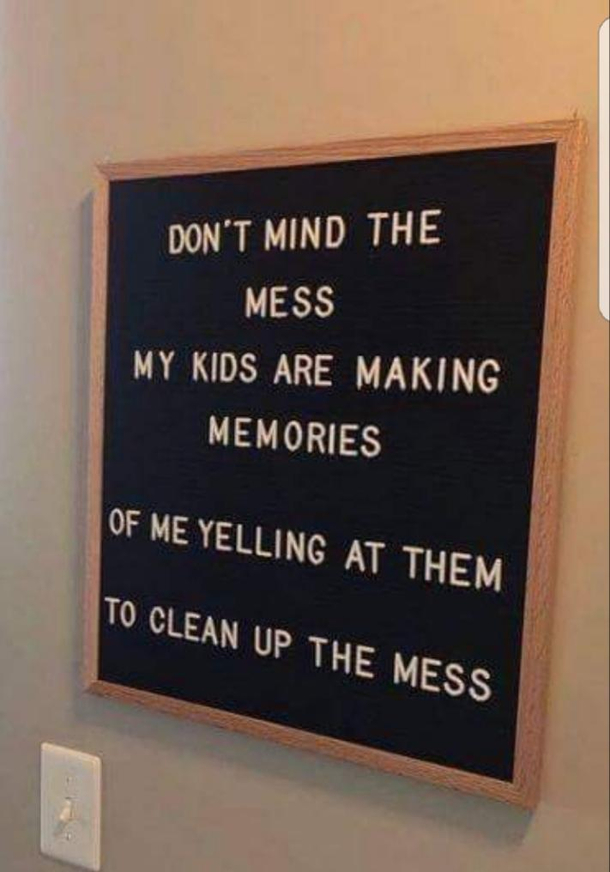
Image resolution: width=610 pixels, height=872 pixels. What are the coordinates of `wall` in the screenshot? It's located at (299, 814).